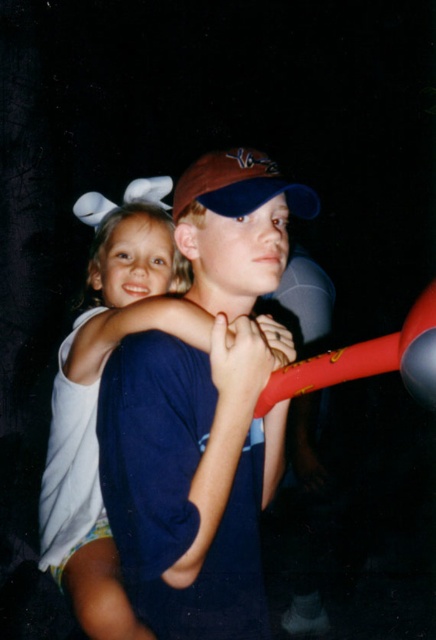
You are a photographer trying to capture a closeup of the white cotton shirt at upper left and the brown fabric baseball cap at center. Since the camera can only focus on one object at a time, which object should you focus on first to ensure it appears sharp in the photo?

The white cotton shirt at upper left is much taller than the brown fabric baseball cap at center, so you should focus on the white cotton shirt at upper left first since it is larger and more prominent in the frame.

Based on the scene description, where is the white cotton shirt at upper left located in terms of coordinates?

The white cotton shirt at upper left is located at coordinates point (96,400).

Based on the photo, you are a photographer trying to focus on the point at location [96,400]. According to the scene, which object is at that point?

The point at [96,400] is on the white cotton shirt at upper left.